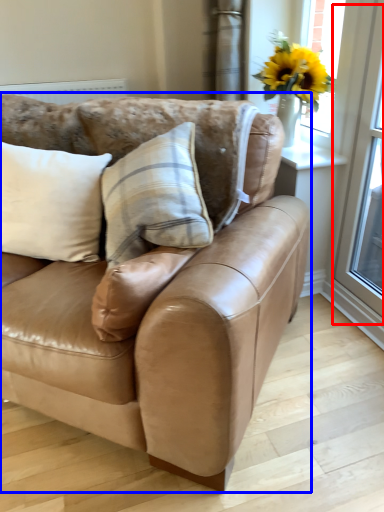
Question: Among these objects, which one is nearest to the camera, screen door (highlighted by a red box) or studio couch (highlighted by a blue box)?

Choices:
 (A) screen door
 (B) studio couch

Answer: (B)